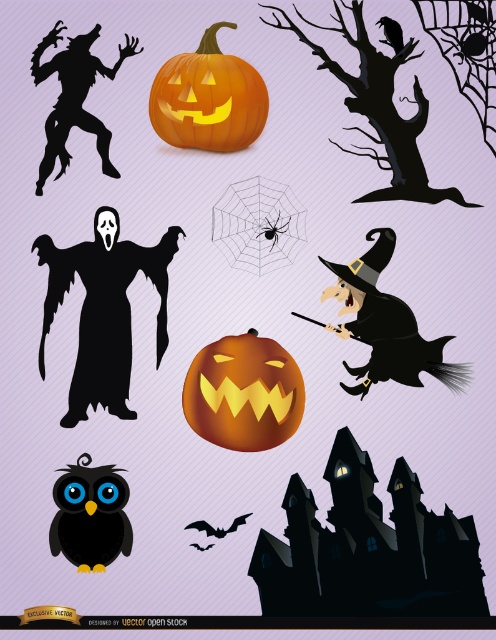
Who is more forward, (217, 134) or (65, 156)?

Positioned in front is point (217, 134).

Does orange matte pumpkin at upper center appear over black matte witch at upper center?

Yes, orange matte pumpkin at upper center is above black matte witch at upper center.

Between point (254, 116) and point (60, 138), which one is positioned behind?

The point (254, 116) is more distant.

Where is `orange matte pumpkin at upper center`? This screenshot has width=496, height=640. orange matte pumpkin at upper center is located at coordinates point(207,99).

Who is more distant from viewer, (168, 125) or (59, 529)?

The point (168, 125) is behind.

Is orange matte pumpkin at upper center to the left of black matte/soft owl at lower left from the viewer's perspective?

In fact, orange matte pumpkin at upper center is to the right of black matte/soft owl at lower left.

This screenshot has width=496, height=640. I want to click on orange matte pumpkin at upper center, so tap(207, 99).

In order to click on orange matte pumpkin at upper center in this screenshot , I will do `click(207, 99)`.

Who is higher up, matte orange pumpkin at center or orange matte pumpkin at upper center?

orange matte pumpkin at upper center is higher up.

Which is behind, point (249, 352) or point (255, 136)?

The point (255, 136) is behind.

Locate an element on the screen. The width and height of the screenshot is (496, 640). matte orange pumpkin at center is located at coordinates (244, 392).